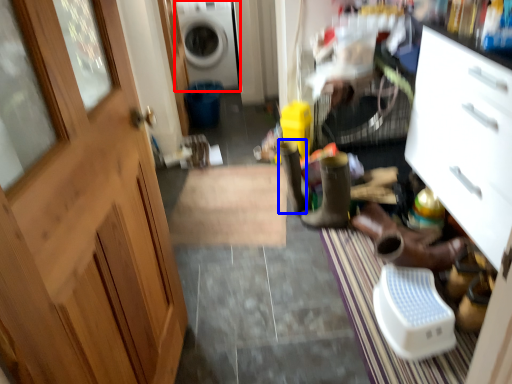
Question: Which object appears farthest to the camera in this image, washing machine (highlighted by a red box) or boot (highlighted by a blue box)?

Choices:
 (A) washing machine
 (B) boot

Answer: (A)